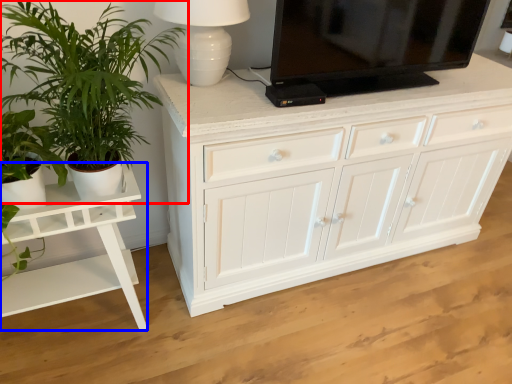
Question: Which object appears farthest to the camera in this image, houseplant (highlighted by a red box) or table (highlighted by a blue box)?

Choices:
 (A) houseplant
 (B) table

Answer: (B)